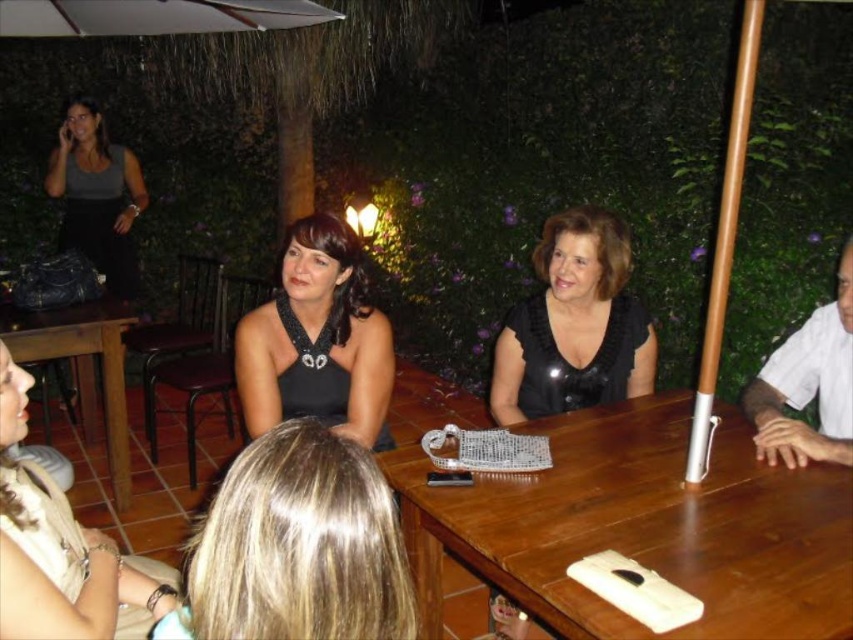
Question: Where is blonde hair at lower center located in relation to beige fabric purse at lower left in the image?

Choices:
 (A) left
 (B) right

Answer: (B)

Question: Among these objects, which one is nearest to the camera?

Choices:
 (A) white fabric umbrella at upper center
 (B) blonde hair at lower center
 (C) matte black dress at upper left

Answer: (B)

Question: Which of the following is the closest to the observer?

Choices:
 (A) brown wooden table at lower left
 (B) beige fabric purse at lower left
 (C) black satin blouse at center
 (D) blonde hair at lower center

Answer: (D)

Question: Does blonde hair at lower center appear on the right side of matte black dress at upper left?

Choices:
 (A) no
 (B) yes

Answer: (B)

Question: Does blonde hair at lower center have a lesser width compared to black satin dress at center?

Choices:
 (A) no
 (B) yes

Answer: (B)

Question: Among these objects, which one is nearest to the camera?

Choices:
 (A) brown wooden table at lower left
 (B) matte black dress at upper left

Answer: (A)